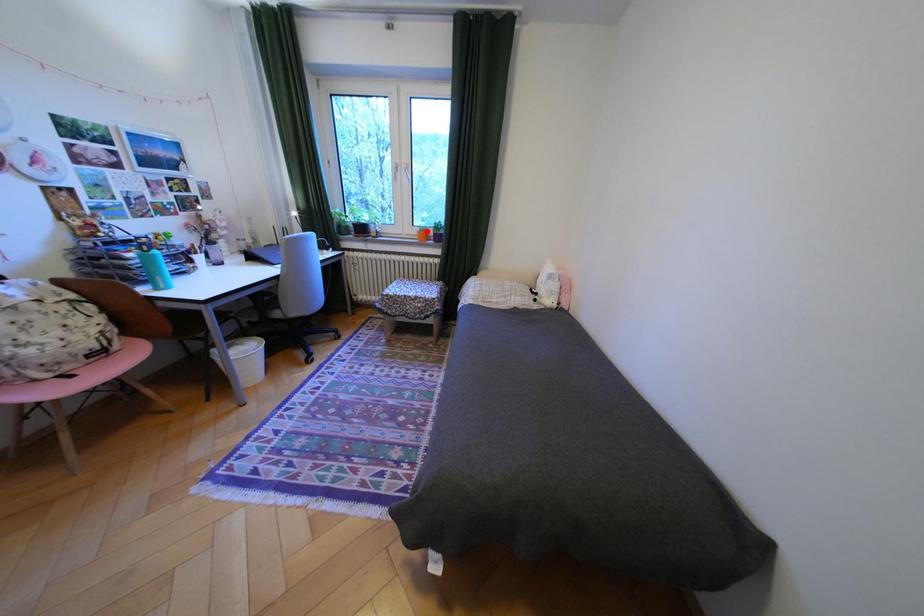
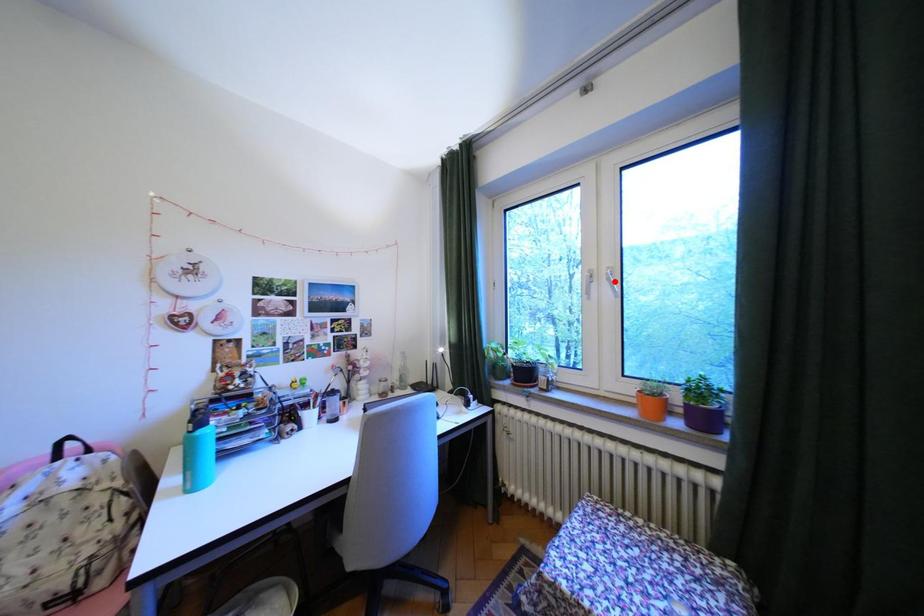
I am providing you with two images of the same scene from different viewpoints. A red point is marked on the first image and another point is marked on the second image. Are the points marked in image1 and image2 representing the same 3D position?

No